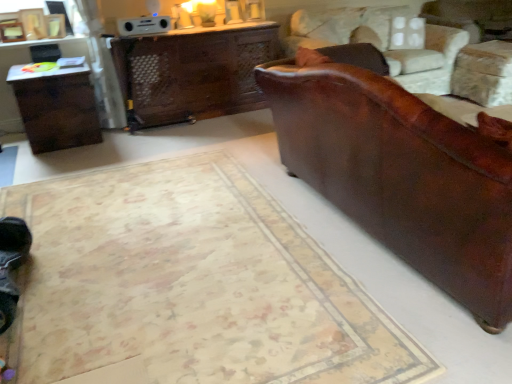
You are a GUI agent. You are given a task and a screenshot of the screen. Output one action in this format:
    pyautogui.click(x=<x>, y=<y>)
    Task: Click on the vacant space in beige carpet at lower right (from a real-world perspective)
    This screenshot has height=384, width=512.
    Given the screenshot: What is the action you would take?
    pyautogui.click(x=200, y=291)